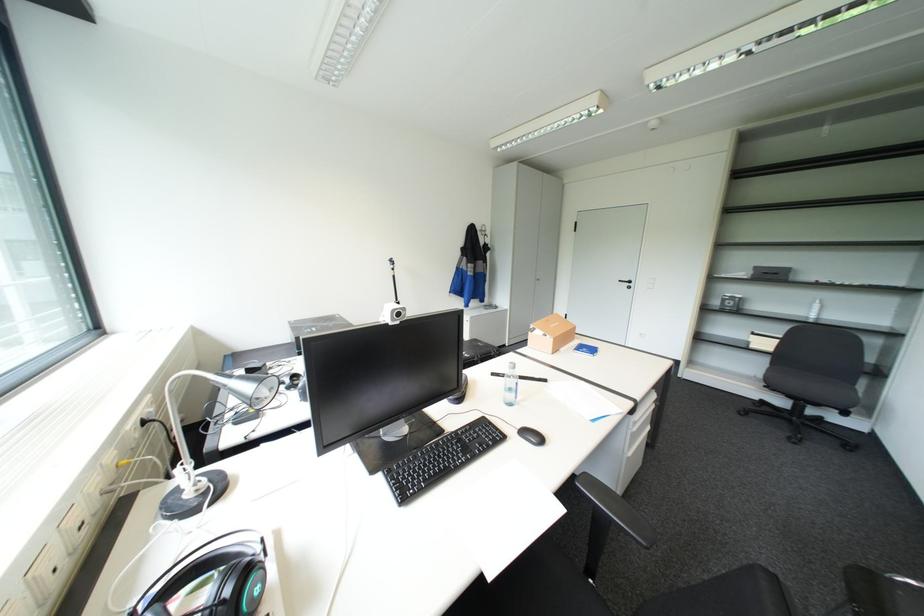
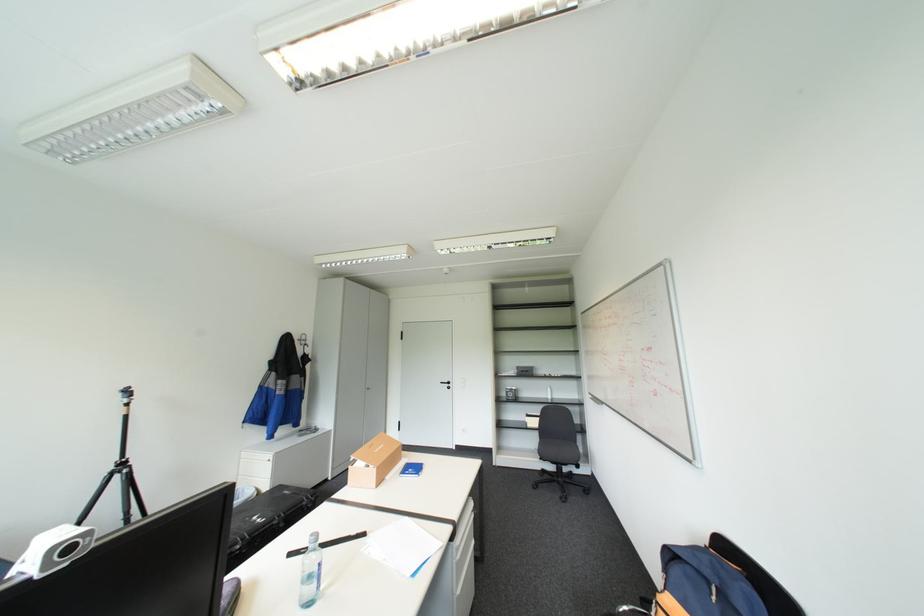
Locate, in the second image, the point that corresponds to point (471, 352) in the first image.

(262, 517)